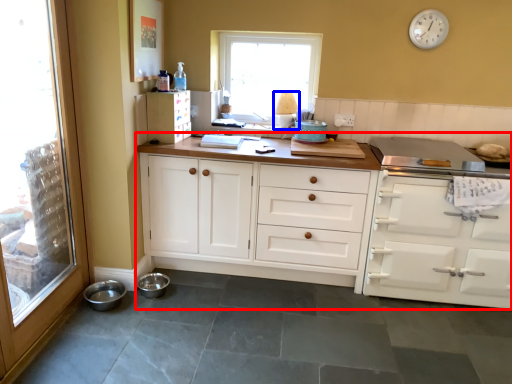
Question: Which object is further to the camera taking this photo, cabinetry (highlighted by a red box) or lamp (highlighted by a blue box)?

Choices:
 (A) cabinetry
 (B) lamp

Answer: (B)